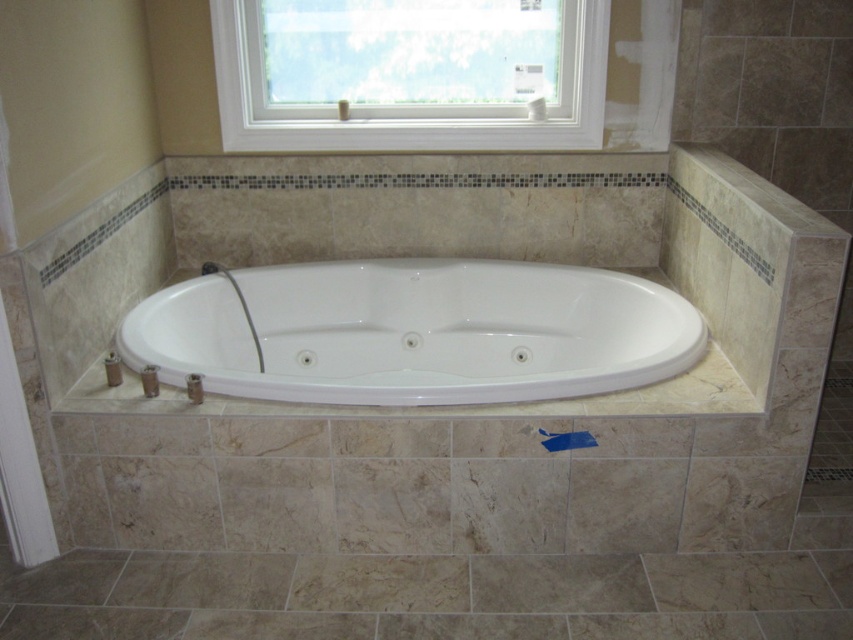
You are standing in the bathroom and want to know where the point at coordinates (407, 74) is located. Based on the scene description, can you determine which object this point belongs to?

The point at coordinates (407, 74) is located on the white plastic window at upper center.